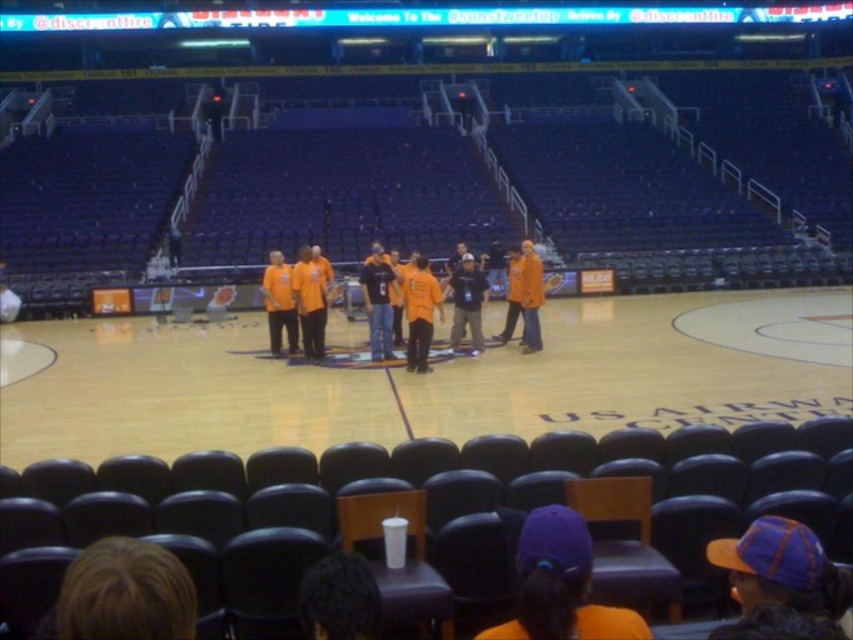
You are a photographer positioned at the entrance of the US AIRWAYS CENTER basketball arena. You want to take a photo of the orange jersey at center from the front. Which direction should you face to ensure the jersey is centered in your view?

The orange jersey at center is located at point coordinates approximately in the middle of the court. Since you are at the entrance, facing towards the court center would center the jersey in your view.

You are standing at the edge of the basketball court in the US AIRWAYS CENTER arena. You notice two points marked on the court floor. The first point is at coordinate position (438,298) and the second point is at (265,284). From your viewpoint, which point appears closer to you?

Point at coordinate position (438,298) appears closer to you because it is closer to the camera than point at coordinate position (265,284).

You are a photographer positioned at the back of the arena. You want to take a photo of the orange cotton shirts at center and the orange jersey at center. Which object will appear larger in your photo?

The orange cotton shirts at center will appear larger in the photo because they are taller than the orange jersey at center.